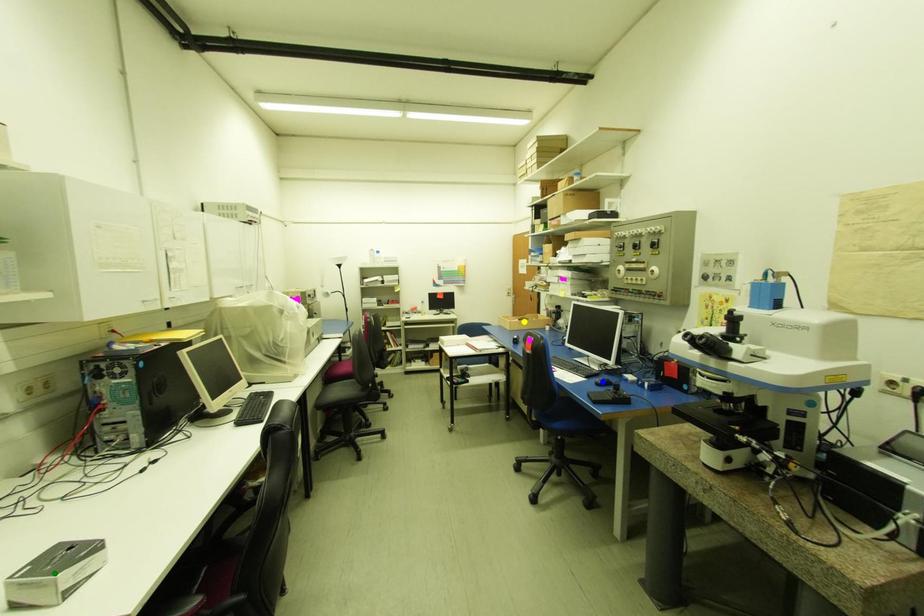
Order these from nearest to farthest:
yellow point, green point, blue point

green point, blue point, yellow point